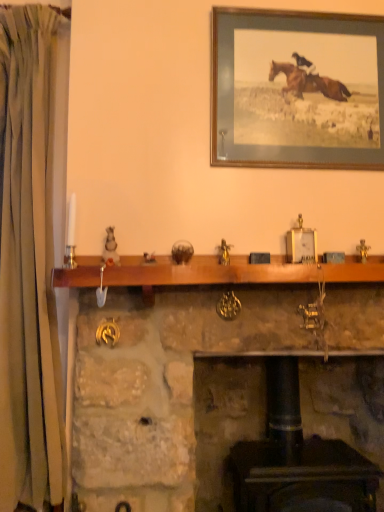
Question: In terms of width, does wooden picture frame at upper center look wider or thinner when compared to stone fireplace at center?

Choices:
 (A) wide
 (B) thin

Answer: (B)

Question: Is wooden picture frame at upper center taller or shorter than stone fireplace at center?

Choices:
 (A) short
 (B) tall

Answer: (A)

Question: Considering the real-world distances, which object is closest to the green fabric curtain at left?

Choices:
 (A) stone fireplace at center
 (B) wooden mantle at center
 (C) wooden picture frame at upper center

Answer: (A)

Question: Which object is the closest to the wooden picture frame at upper center?

Choices:
 (A) wooden mantle at center
 (B) stone fireplace at center
 (C) green fabric curtain at left

Answer: (A)